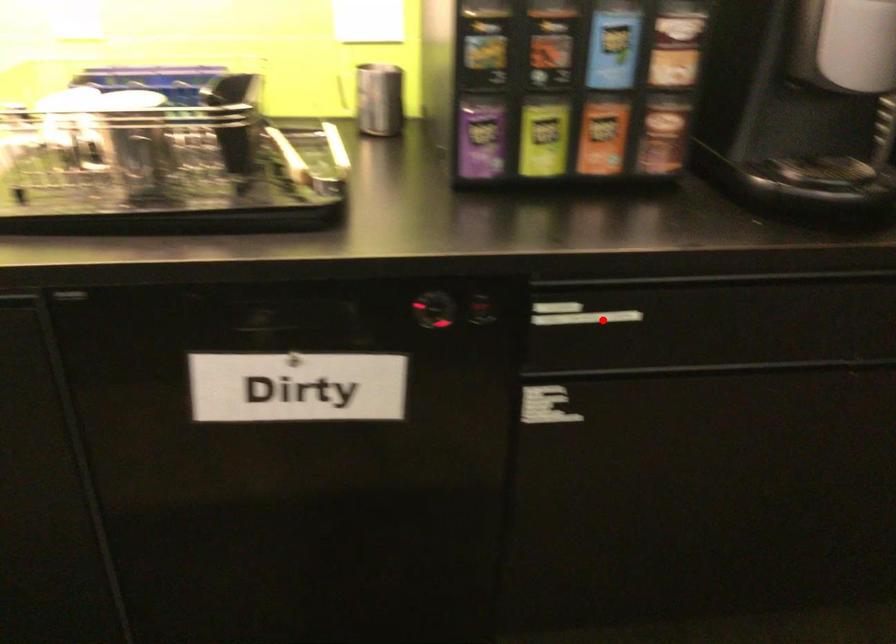
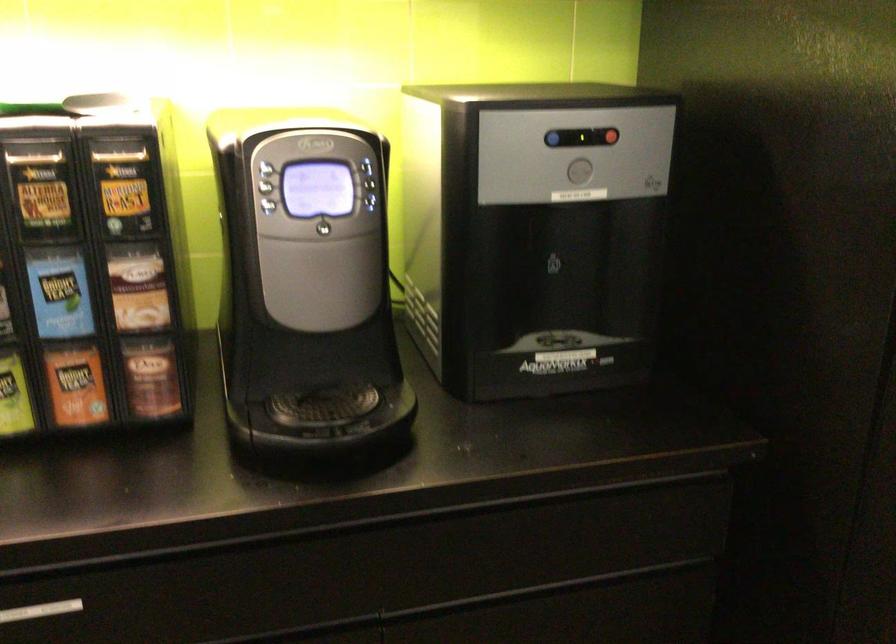
Question: I am providing you with two images of the same scene from different viewpoints. Given a red point in image1, look at the same physical point in image2. Is it:

Choices:
 (A) Closer to the viewpoint
 (B) Farther from the viewpoint

Answer: (A)